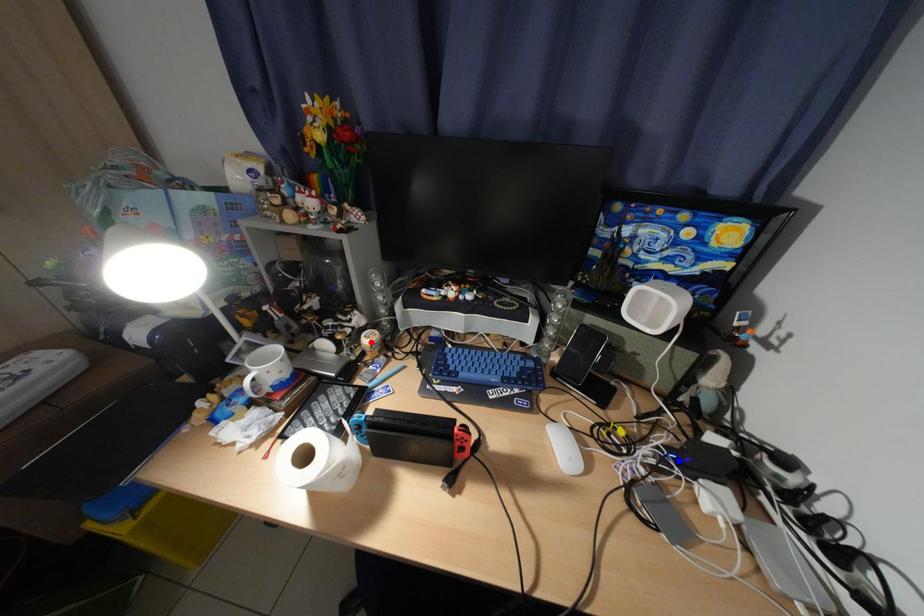
Question: In the image, two points are highlighted. Which point is nearer to the camera? Reply with the corresponding letter.

Choices:
 (A) blue point
 (B) red point

Answer: (A)